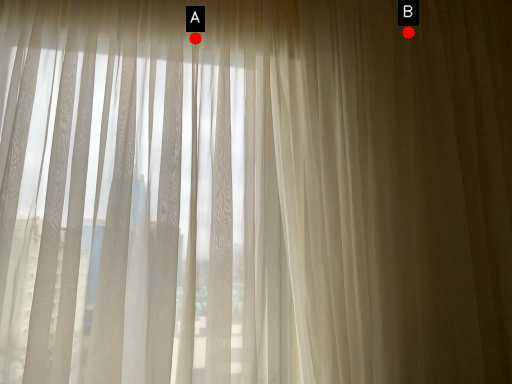
Question: Two points are circled on the image, labeled by A and B beside each circle. Which point is further to the camera?

Choices:
 (A) A is further
 (B) B is further

Answer: (B)